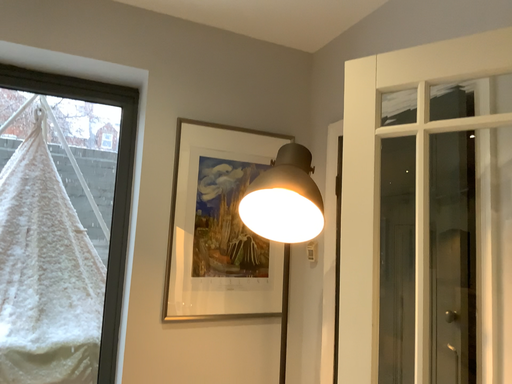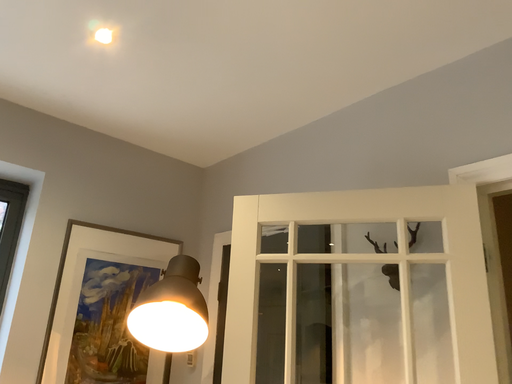
Question: How did the camera likely rotate when shooting the video?

Choices:
 (A) rotated downward
 (B) rotated upward

Answer: (B)